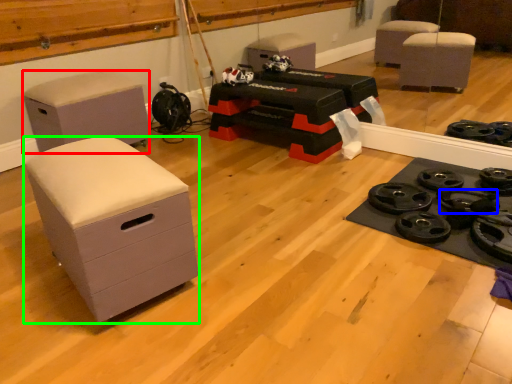
Question: Considering the real-world distances, which object is farthest from furniture (highlighted by a red box)? wheel (highlighted by a blue box) or chest of drawers (highlighted by a green box)?

Choices:
 (A) wheel
 (B) chest of drawers

Answer: (A)